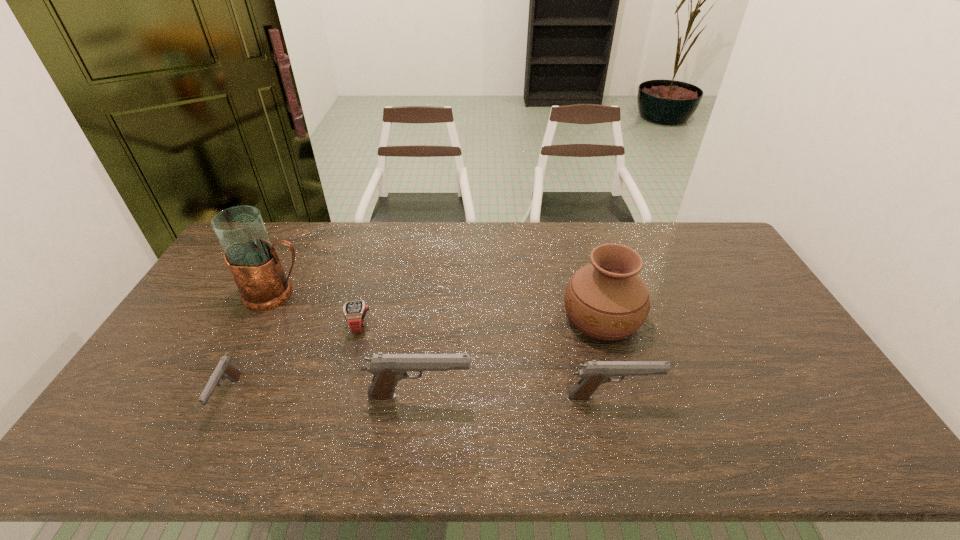
Please show where to add a pistol on the right while keeping spacing even. Please provide its 2D coordinates. Your answer should be formatted as a tuple, i.e. [(x, y)], where the tuple contains the x and y coordinates of a point satisfying the conditions above.

[(804, 398)]